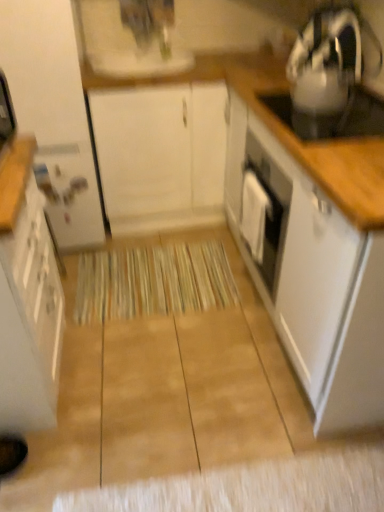
Question: Considering the relative sizes of white matte cabinet at center, the 2th cabinetry when ordered from right to left, and white glossy cabinet at left, acting as the fourth cabinetry starting from the right, in the image provided, is white matte cabinet at center, the 2th cabinetry when ordered from right to left, shorter than white glossy cabinet at left, acting as the fourth cabinetry starting from the right,?

Choices:
 (A) no
 (B) yes

Answer: (B)

Question: Is white matte cabinet at center, acting as the third cabinetry starting from the left, closer to camera compared to white glossy cabinet at left, which ranks as the 1th cabinetry in left-to-right order?

Choices:
 (A) no
 (B) yes

Answer: (A)

Question: Can you confirm if white matte cabinet at center, acting as the third cabinetry starting from the left, is taller than white glossy cabinet at left, which ranks as the 1th cabinetry in left-to-right order?

Choices:
 (A) yes
 (B) no

Answer: (B)

Question: Is white matte cabinet at center, the 2th cabinetry when ordered from right to left, facing towards white glossy cabinet at left, acting as the fourth cabinetry starting from the right?

Choices:
 (A) no
 (B) yes

Answer: (A)

Question: Is white matte cabinet at center, acting as the third cabinetry starting from the left, behind white glossy cabinet at left, acting as the fourth cabinetry starting from the right?

Choices:
 (A) no
 (B) yes

Answer: (B)

Question: In terms of width, does beige textured mat at center look wider or thinner when compared to white matte cabinet at center, acting as the third cabinetry starting from the left?

Choices:
 (A) thin
 (B) wide

Answer: (A)

Question: Looking at the image, does beige textured mat at center seem bigger or smaller compared to white matte cabinet at center, acting as the third cabinetry starting from the left?

Choices:
 (A) small
 (B) big

Answer: (A)

Question: Is beige textured mat at center spatially inside white matte cabinet at center, the 2th cabinetry when ordered from right to left, or outside of it?

Choices:
 (A) inside
 (B) outside

Answer: (B)

Question: Is beige textured mat at center taller or shorter than white matte cabinet at center, the 2th cabinetry when ordered from right to left?

Choices:
 (A) tall
 (B) short

Answer: (B)

Question: Is white matte cabinet at center, the 2th cabinetry when ordered from right to left, in front of or behind beige textured mat at center in the image?

Choices:
 (A) front
 (B) behind

Answer: (A)

Question: Considering the positions of white matte cabinet at center, acting as the third cabinetry starting from the left, and beige textured mat at center in the image, is white matte cabinet at center, acting as the third cabinetry starting from the left, bigger or smaller than beige textured mat at center?

Choices:
 (A) big
 (B) small

Answer: (A)

Question: From their relative heights in the image, would you say white matte cabinet at center, acting as the third cabinetry starting from the left, is taller or shorter than beige textured mat at center?

Choices:
 (A) short
 (B) tall

Answer: (B)

Question: From a real-world perspective, is white matte cabinet at center, the 2th cabinetry when ordered from right to left, positioned above or below beige textured mat at center?

Choices:
 (A) below
 (B) above

Answer: (B)

Question: Is beige textured mat at center inside the boundaries of metallic silver kettle at upper right, or outside?

Choices:
 (A) inside
 (B) outside

Answer: (B)

Question: Considering the relative positions of beige textured mat at center and metallic silver kettle at upper right in the image provided, is beige textured mat at center to the left or to the right of metallic silver kettle at upper right?

Choices:
 (A) right
 (B) left

Answer: (B)